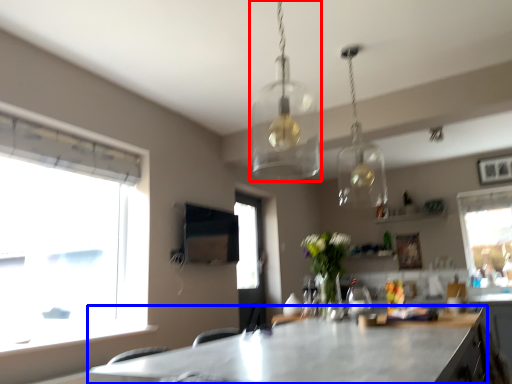
Question: Which object is further to the camera taking this photo, lamp (highlighted by a red box) or table (highlighted by a blue box)?

Choices:
 (A) lamp
 (B) table

Answer: (A)